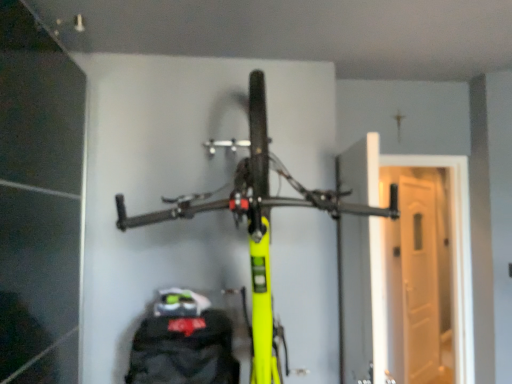
Question: From their relative heights in the image, would you say white glossy door at right is taller or shorter than neon yellow bike at center?

Choices:
 (A) short
 (B) tall

Answer: (A)

Question: From a real-world perspective, is white glossy door at right positioned above or below neon yellow bike at center?

Choices:
 (A) below
 (B) above

Answer: (A)

Question: Is point (434, 157) positioned closer to the camera than point (250, 89)?

Choices:
 (A) farther
 (B) closer

Answer: (A)

Question: From the image's perspective, is neon yellow bike at center above or below white glossy door at right?

Choices:
 (A) below
 (B) above

Answer: (B)

Question: In terms of width, does neon yellow bike at center look wider or thinner when compared to white glossy door at right?

Choices:
 (A) wide
 (B) thin

Answer: (A)

Question: Visually, is neon yellow bike at center positioned to the left or to the right of white glossy door at right?

Choices:
 (A) left
 (B) right

Answer: (A)

Question: Which is correct: neon yellow bike at center is inside white glossy door at right, or outside of it?

Choices:
 (A) inside
 (B) outside

Answer: (B)